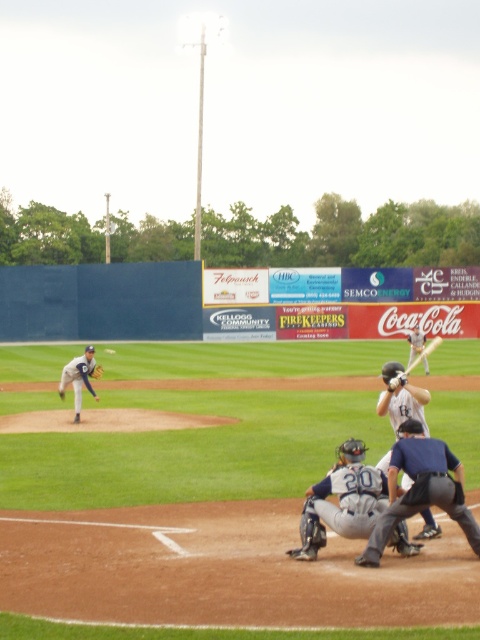
Measure the distance between gray uniformed pitcher at left and camera.

gray uniformed pitcher at left and camera are 16.43 meters apart from each other.

Can you confirm if gray uniformed pitcher at left is positioned below dark gray leather glove at center?

Indeed, gray uniformed pitcher at left is positioned under dark gray leather glove at center.

You are a GUI agent. You are given a task and a screenshot of the screen. Output one action in this format:
    pyautogui.click(x=<x>, y=<y>)
    Task: Click on the gray uniformed pitcher at left
    This screenshot has width=480, height=640.
    Given the screenshot: What is the action you would take?
    pyautogui.click(x=80, y=378)

Does matte white bat at center appear over gray uniformed pitcher at left?

Indeed, matte white bat at center is positioned over gray uniformed pitcher at left.

Can you confirm if matte white bat at center is bigger than gray uniformed pitcher at left?

No.

Who is more distant from viewer, (389, 458) or (73, 388)?

The point (73, 388) is behind.

Identify the location of matte white bat at center. The width and height of the screenshot is (480, 640). (400, 397).

Does point (400, 371) lie behind point (95, 374)?

No, (400, 371) is closer to viewer.

Does point (396, 365) lie in front of point (94, 378)?

Yes, it is.

The image size is (480, 640). I want to click on matte white bat at center, so click(x=400, y=397).

Where is `matte white bat at center`? matte white bat at center is located at coordinates (400, 397).